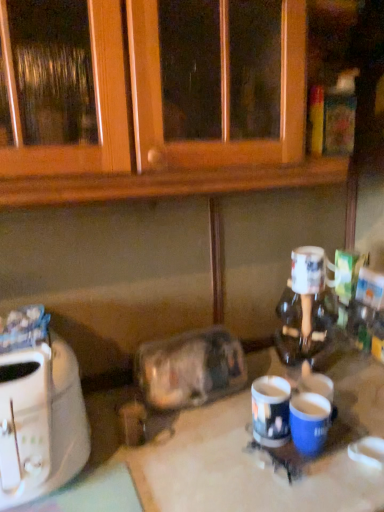
Question: Would you say white plastic toaster at left is a long distance from white glossy table at center?

Choices:
 (A) no
 (B) yes

Answer: (A)

Question: From a real-world perspective, is white plastic toaster at left positioned under white glossy table at center based on gravity?

Choices:
 (A) no
 (B) yes

Answer: (A)

Question: Could you tell me if white plastic toaster at left is facing white glossy table at center?

Choices:
 (A) yes
 (B) no

Answer: (B)

Question: Does white plastic toaster at left have a greater height compared to white glossy table at center?

Choices:
 (A) yes
 (B) no

Answer: (B)

Question: From the image's perspective, would you say white plastic toaster at left is shown under white glossy table at center?

Choices:
 (A) yes
 (B) no

Answer: (B)

Question: From the image's perspective, is white plastic toaster at left on white glossy table at center?

Choices:
 (A) no
 (B) yes

Answer: (B)

Question: From the image's perspective, is white glossy mug at right, which appears as the first coffee cup when viewed from the top, located above blue glossy mug at center, positioned as the second coffee cup in bottom-to-top order?

Choices:
 (A) no
 (B) yes

Answer: (B)

Question: Could you tell me if white glossy mug at right, positioned as the third coffee cup in bottom-to-top order, is facing blue glossy mug at center, positioned as the second coffee cup in bottom-to-top order?

Choices:
 (A) yes
 (B) no

Answer: (B)

Question: Is white glossy mug at right, which appears as the first coffee cup when viewed from the top, shorter than blue glossy mug at center, positioned as the second coffee cup in bottom-to-top order?

Choices:
 (A) no
 (B) yes

Answer: (B)

Question: Does white glossy mug at right, positioned as the third coffee cup in bottom-to-top order, contain blue glossy mug at center, positioned as the second coffee cup in bottom-to-top order?

Choices:
 (A) yes
 (B) no

Answer: (B)

Question: Considering the relative positions of white glossy mug at right, positioned as the third coffee cup in bottom-to-top order, and blue glossy mug at center, the 2th coffee cup when ordered from top to bottom, in the image provided, is white glossy mug at right, positioned as the third coffee cup in bottom-to-top order, behind blue glossy mug at center, the 2th coffee cup when ordered from top to bottom,?

Choices:
 (A) yes
 (B) no

Answer: (A)

Question: From the image's perspective, is white glossy mug at right, which appears as the first coffee cup when viewed from the top, beneath blue glossy mug at center, positioned as the second coffee cup in bottom-to-top order?

Choices:
 (A) no
 (B) yes

Answer: (A)

Question: Can you confirm if white glossy mug at right, which appears as the first coffee cup when viewed from the top, is positioned to the left of white plastic toaster at left?

Choices:
 (A) no
 (B) yes

Answer: (A)